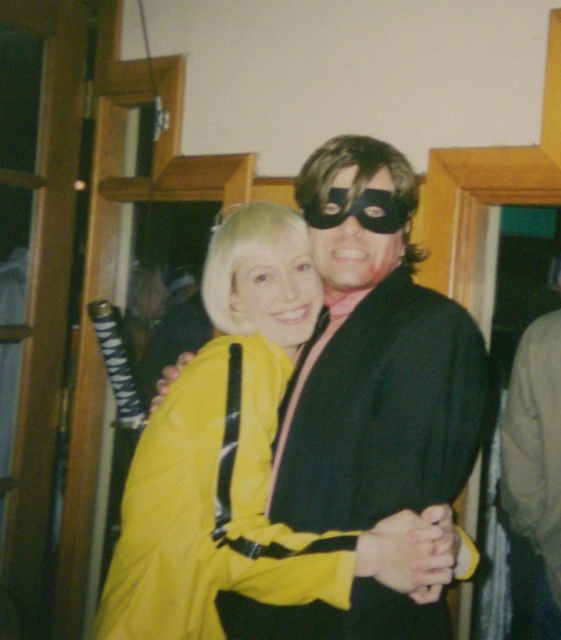
Is black matte robe at center taller than yellow matte jacket at center?

Yes, black matte robe at center is taller than yellow matte jacket at center.

Between black matte robe at center and yellow matte jacket at center, which one is positioned higher?

Positioned higher is yellow matte jacket at center.

The height and width of the screenshot is (640, 561). I want to click on black matte robe at center, so click(380, 412).

Where is `black matte robe at center`? This screenshot has width=561, height=640. black matte robe at center is located at coordinates (380, 412).

Can you confirm if brown suede jacket at right is positioned to the left of yellow matte jacket at center?

No, brown suede jacket at right is not to the left of yellow matte jacket at center.

Between point (517, 618) and point (315, 280), which one is positioned behind?

The point (517, 618) is more distant.

Who is more distant from viewer, (546, 291) or (243, 252)?

The point (546, 291) is behind.

Find the location of a particular element. Image resolution: width=561 pixels, height=640 pixels. brown suede jacket at right is located at coordinates (532, 442).

Who is lower down, brown suede jacket at right or black matte mask at center?

brown suede jacket at right is below.

Does point (558, 253) come farther from viewer compared to point (350, 284)?

Yes, point (558, 253) is farther from viewer.

This screenshot has height=640, width=561. I want to click on brown suede jacket at right, so click(x=532, y=442).

You are a GUI agent. You are given a task and a screenshot of the screen. Output one action in this format:
    pyautogui.click(x=<x>, y=<y>)
    Task: Click on the brown suede jacket at right
    
    Given the screenshot: What is the action you would take?
    pyautogui.click(x=532, y=442)